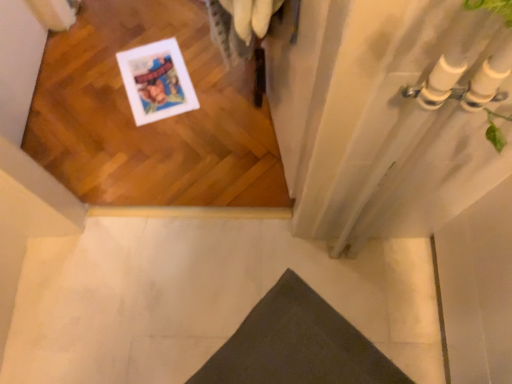
In order to click on empty space that is ontop of white tile floor at lower left in this screenshot , I will do `click(224, 299)`.